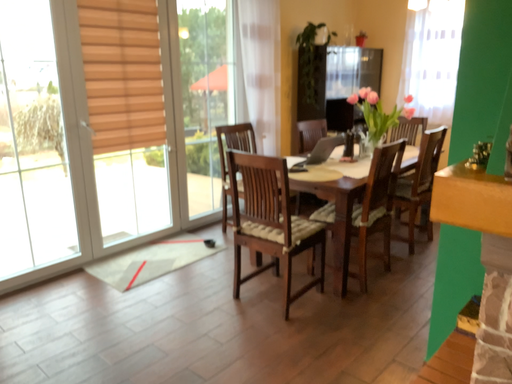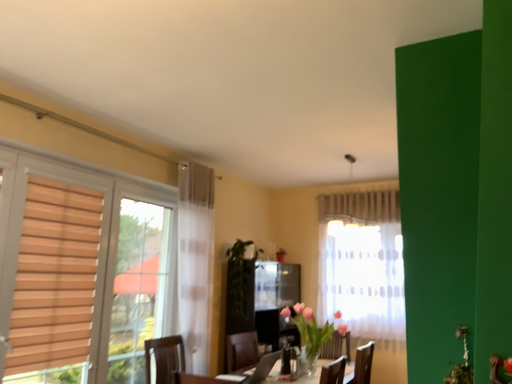
Question: Which way did the camera rotate in the video?

Choices:
 (A) rotated downward
 (B) rotated upward

Answer: (B)